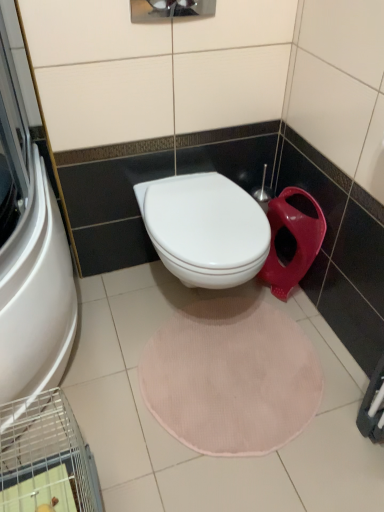
Locate an element on the screen. The height and width of the screenshot is (512, 384). vacant area on top of pink fabric bath mat at center (from a real-world perspective) is located at coordinates (230, 365).